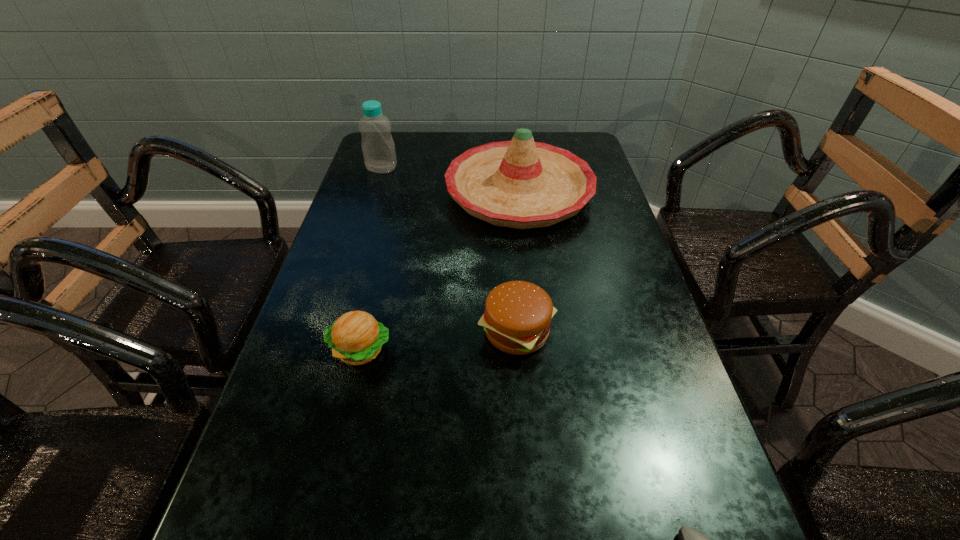
Where is `bottle that is positioned at the left edge`? Image resolution: width=960 pixels, height=540 pixels. bottle that is positioned at the left edge is located at coordinates (378, 147).

At what (x,y) coordinates should I click in order to perform the action: click on hamburger present at the left edge. Please return your answer as a coordinate pair (x, y). The width and height of the screenshot is (960, 540). Looking at the image, I should click on (356, 338).

Locate an element on the screen. object that is positioned at the right edge is located at coordinates (522, 184).

You are a GUI agent. You are given a task and a screenshot of the screen. Output one action in this format:
    pyautogui.click(x=<x>, y=<y>)
    Task: Click on the object present at the far left corner
    The width and height of the screenshot is (960, 540).
    Given the screenshot: What is the action you would take?
    pyautogui.click(x=378, y=147)

At what (x,y) coordinates should I click in order to perform the action: click on object present at the far right corner. Please return your answer as a coordinate pair (x, y). Image resolution: width=960 pixels, height=540 pixels. Looking at the image, I should click on (522, 184).

Image resolution: width=960 pixels, height=540 pixels. In the image, there is a desktop. Identify the location of free space at the far edge. (464, 149).

At what (x,y) coordinates should I click in order to perform the action: click on free space at the left edge of the desktop. Please return your answer as a coordinate pair (x, y). Looking at the image, I should click on (298, 538).

In the image, there is a desktop. Where is `vacant space at the right edge`? vacant space at the right edge is located at coordinates (664, 538).

At what (x,y) coordinates should I click in order to perform the action: click on free space at the far left corner of the desktop. Please return your answer as a coordinate pair (x, y). Looking at the image, I should click on [x=419, y=134].

Identify the location of free space at the far right corner of the desktop. (556, 145).